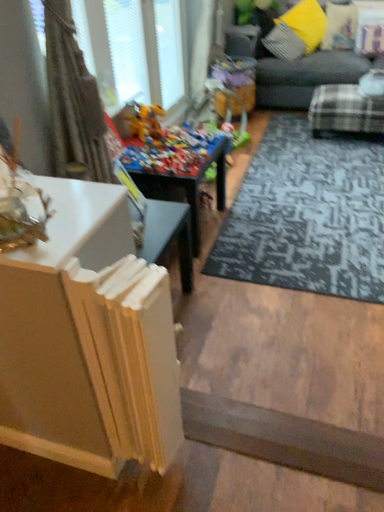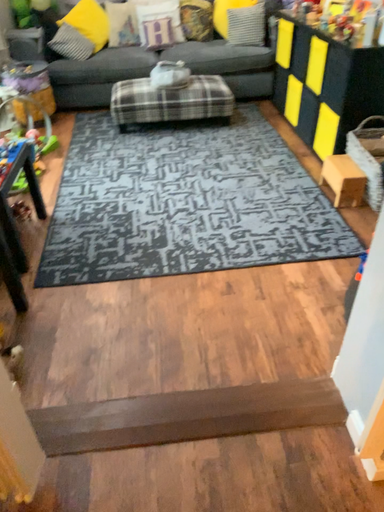
Question: How did the camera likely rotate when shooting the video?

Choices:
 (A) rotated right
 (B) rotated left

Answer: (A)